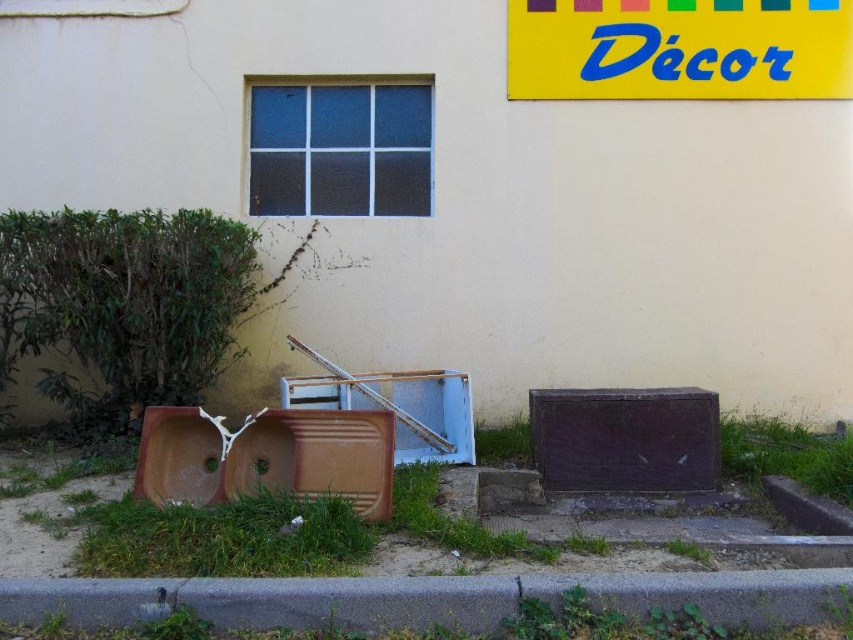
Is point (239, 616) more distant than point (302, 483)?

No.

Is point (587, 584) less distant than point (299, 429)?

Yes, point (587, 584) is in front of point (299, 429).

Is point (850, 572) closer to camera compared to point (183, 490)?

Yes.

What are the coordinates of `gray asphalt curb at lower center` in the screenshot? It's located at (426, 598).

Does gray asphalt curb at lower center appear over yellow plastic sign at upper center?

Actually, gray asphalt curb at lower center is below yellow plastic sign at upper center.

Is gray asphalt curb at lower center smaller than yellow plastic sign at upper center?

Correct, gray asphalt curb at lower center occupies less space than yellow plastic sign at upper center.

Where is `gray asphalt curb at lower center`? gray asphalt curb at lower center is located at coordinates (426, 598).

The image size is (853, 640). In order to click on yellow plastic sign at upper center in this screenshot , I will do `click(679, 49)`.

Who is lower down, yellow plastic sign at upper center or brown matte sink at lower left?

brown matte sink at lower left

Who is more forward, (520, 58) or (184, 454)?

Point (184, 454) is more forward.

What are the coordinates of `yellow plastic sign at upper center` in the screenshot? It's located at (679, 49).